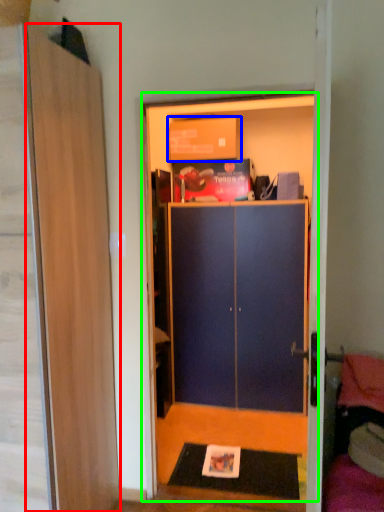
Question: Based on their relative distances, which object is nearer to door (highlighted by a red box)? Choose from cardboard box (highlighted by a blue box) and dresser (highlighted by a green box).

Choices:
 (A) cardboard box
 (B) dresser

Answer: (A)